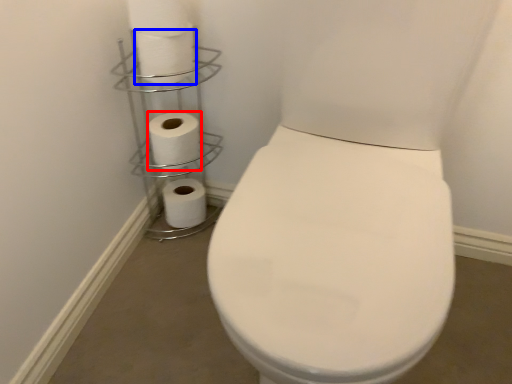
Question: Which object appears closest to the camera in this image, toilet paper (highlighted by a red box) or toilet paper (highlighted by a blue box)?

Choices:
 (A) toilet paper
 (B) toilet paper

Answer: (B)